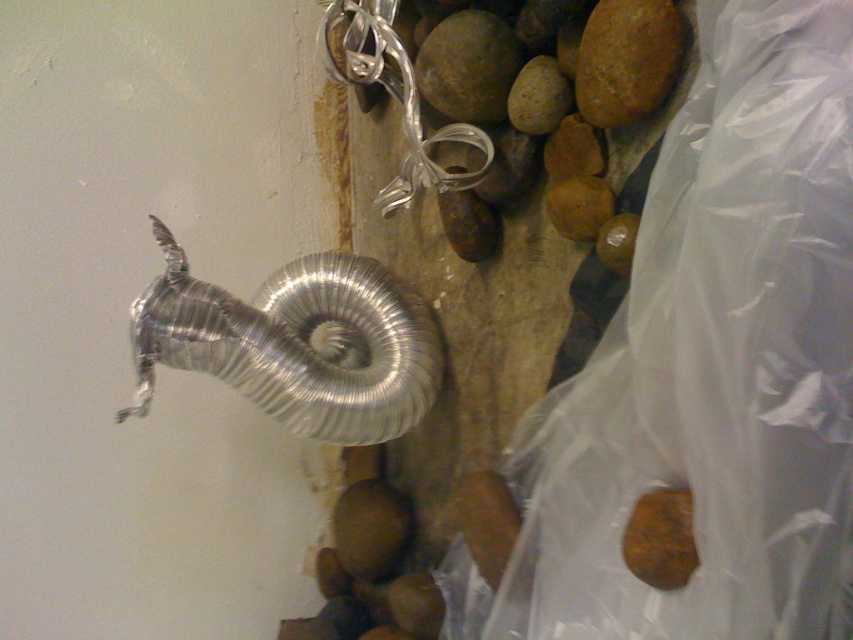
Consider the image. What is located at the coordinates point (625, 60)?

The smooth brown rock at upper right is located at point (625, 60).